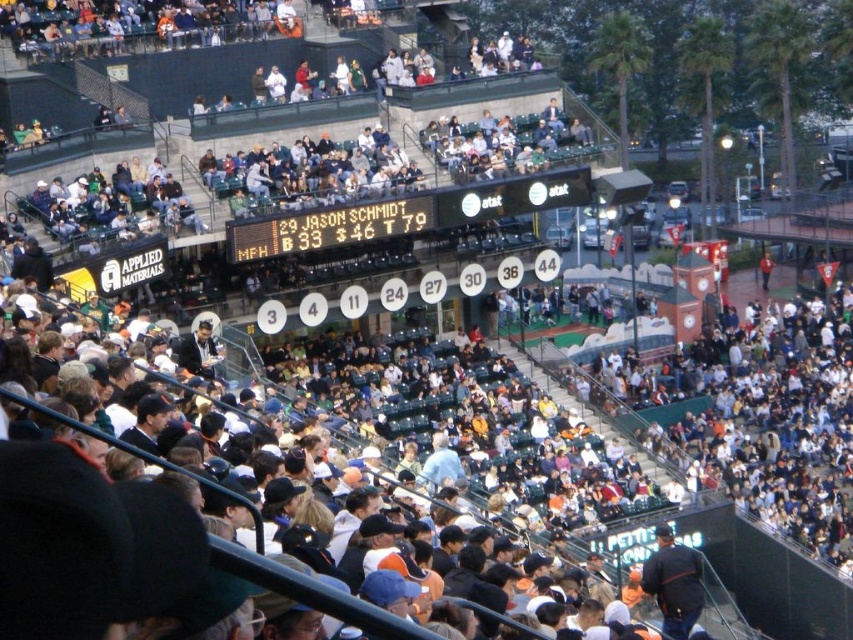
Does point (468, 216) come behind point (238, 228)?

That is True.

Can you confirm if black plastic scoreboard at upper center is positioned to the left of black digital scoreboard at center?

Incorrect, black plastic scoreboard at upper center is not on the left side of black digital scoreboard at center.

Locate an element on the screen. The image size is (853, 640). black plastic scoreboard at upper center is located at coordinates (404, 214).